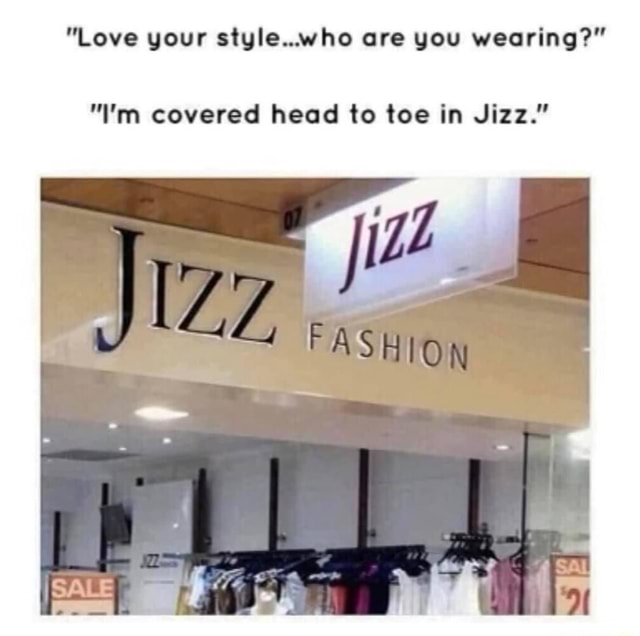
Image resolution: width=640 pixels, height=636 pixels. What are the coordinates of `lighted jizz sign` in the screenshot? It's located at (397, 235).